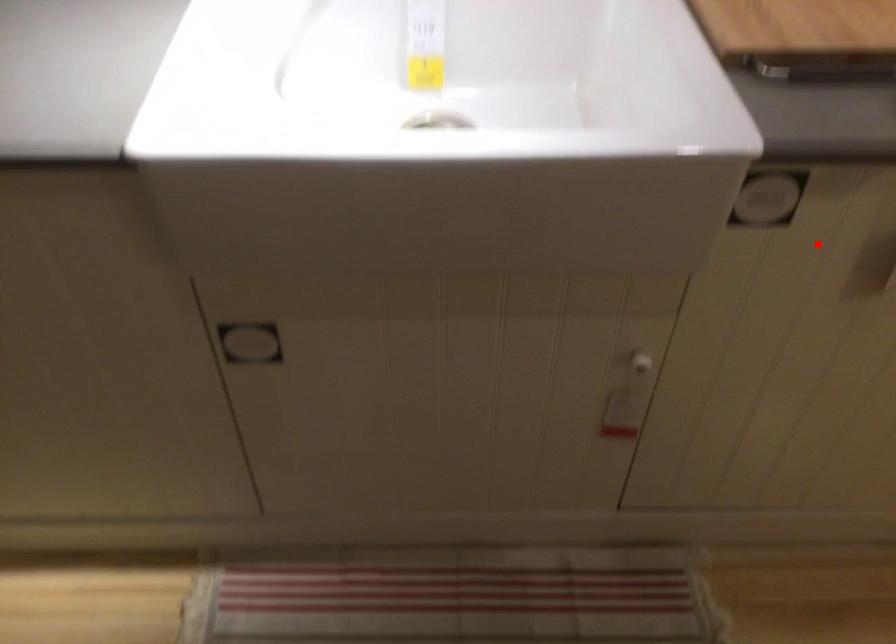
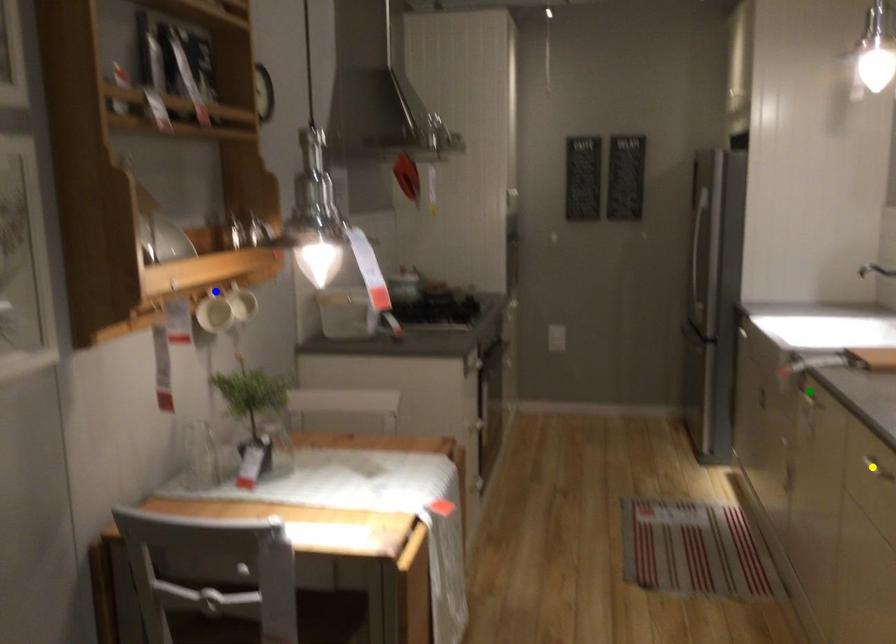
Question: I am providing you with two images of the same scene from different viewpoints. A red point is marked on the first image. You are given multiple points on the second image. Can you choose the point in image 2 that corresponds to the point in image 1?

Choices:
 (A) yellow point
 (B) blue point
 (C) green point

Answer: (C)